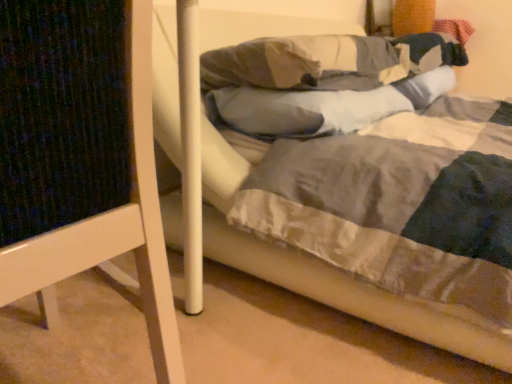
The height and width of the screenshot is (384, 512). In order to click on vacant space in white wood bed frame at left (from a real-world perspective) in this screenshot , I will do `click(91, 330)`.